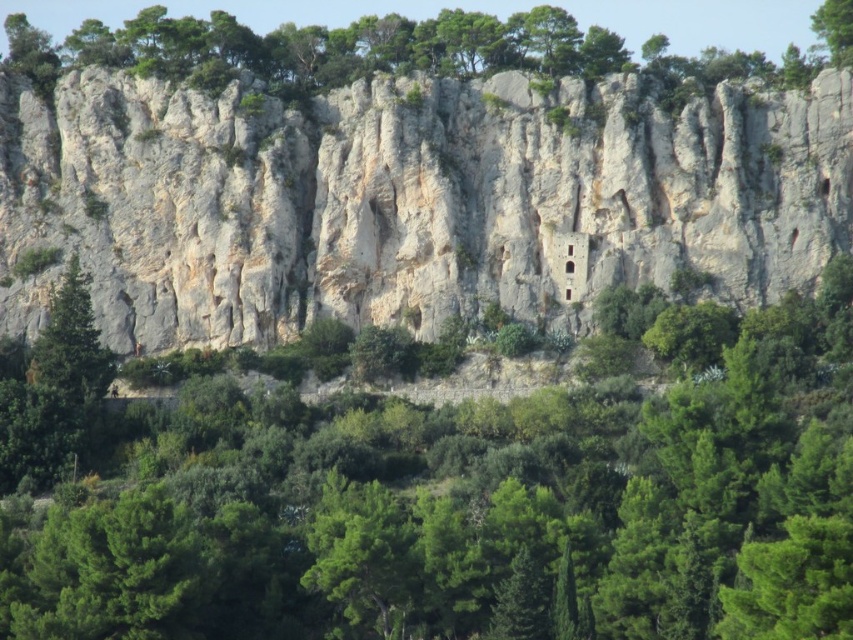
You are a geologist standing at the base of the cliff. You need to locate the white rock cliff at center. According to the coordinates provided, where should you look?

The white rock cliff at center is located at coordinates point (407, 198).